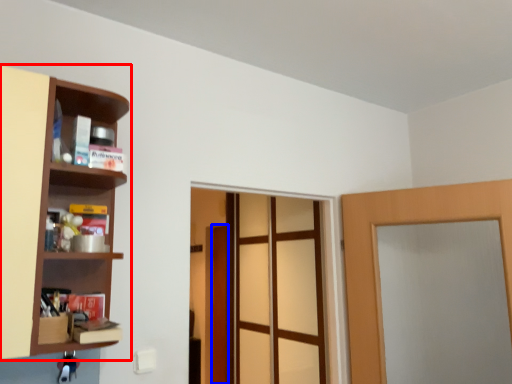
Question: Which of the following is the closest to the observer, shelf (highlighted by a red box) or door (highlighted by a blue box)?

Choices:
 (A) shelf
 (B) door

Answer: (A)